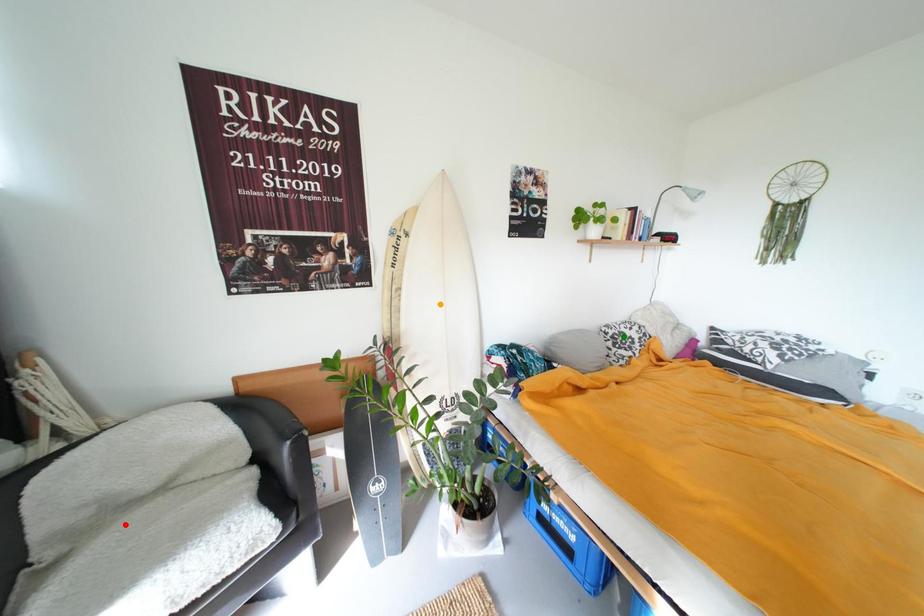
Order these from nearest to farthest:
1. orange point
2. green point
3. red point

red point → orange point → green point